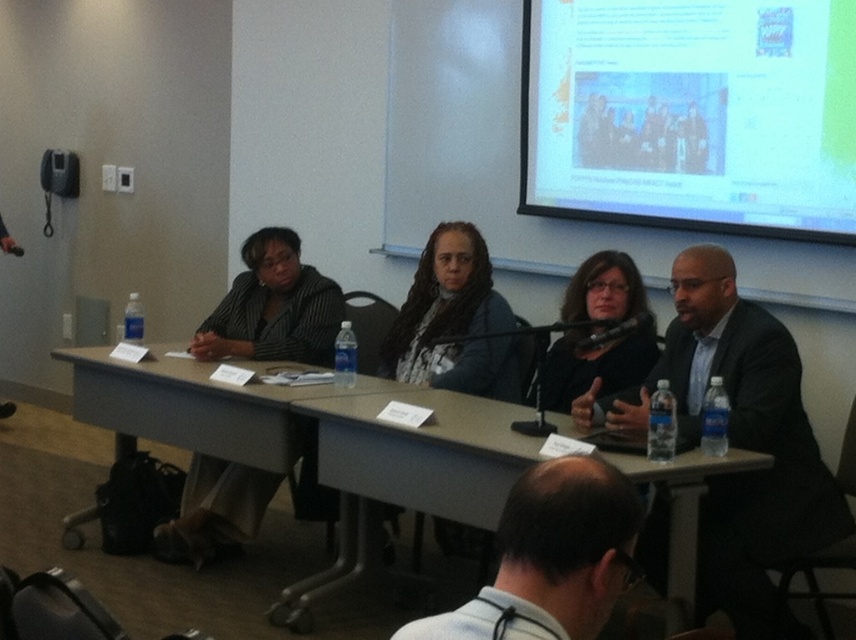
Who is shorter, gray/wooden table at center or black matte jacket at center?

gray/wooden table at center

Is gray/wooden table at center wider than black matte jacket at center?

Yes.

Locate an element on the screen. Image resolution: width=856 pixels, height=640 pixels. gray/wooden table at center is located at coordinates (200, 428).

Is white glossy projector screen at upper right positioned before black matte jacket at center?

No, it is not.

Can you confirm if white glossy projector screen at upper right is positioned to the right of black matte jacket at center?

Indeed, white glossy projector screen at upper right is positioned on the right side of black matte jacket at center.

Between point (635, 166) and point (566, 312), which one is positioned in front?

Positioned in front is point (566, 312).

You are a GUI agent. You are given a task and a screenshot of the screen. Output one action in this format:
    pyautogui.click(x=<x>, y=<y>)
    Task: Click on the white glossy projector screen at upper right
    
    Given the screenshot: What is the action you would take?
    pyautogui.click(x=691, y=115)

Between point (197, 552) and point (572, 541), which one is positioned in front?

Point (572, 541) is in front.

Where is `gray/wooden table at center`? gray/wooden table at center is located at coordinates coord(200,428).